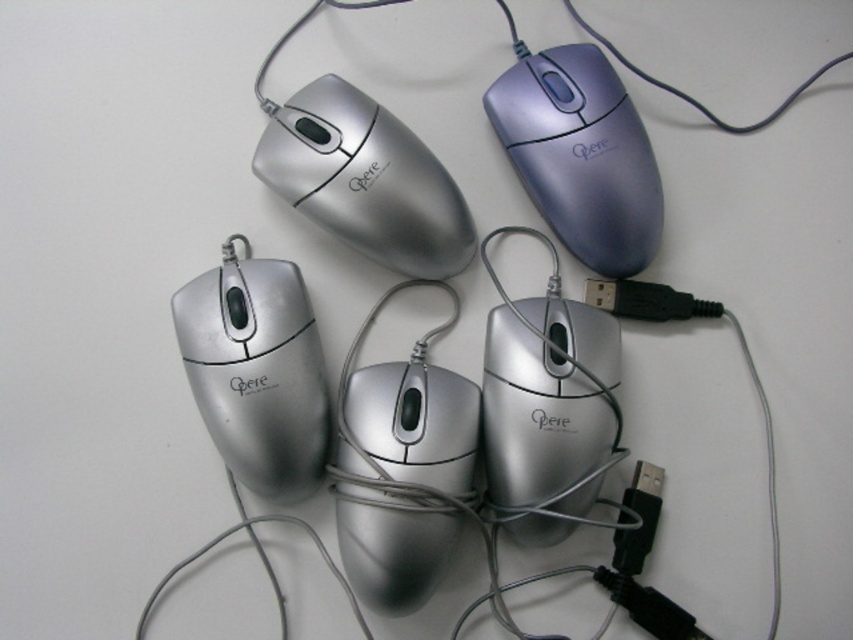
You are standing in front of the arrangement of computer mice. There are two points marked on the image at coordinates point (502,464) and point (297,28). Which of these points is nearer to you?

Point (502,464) is closer to the viewer than point (297,28).